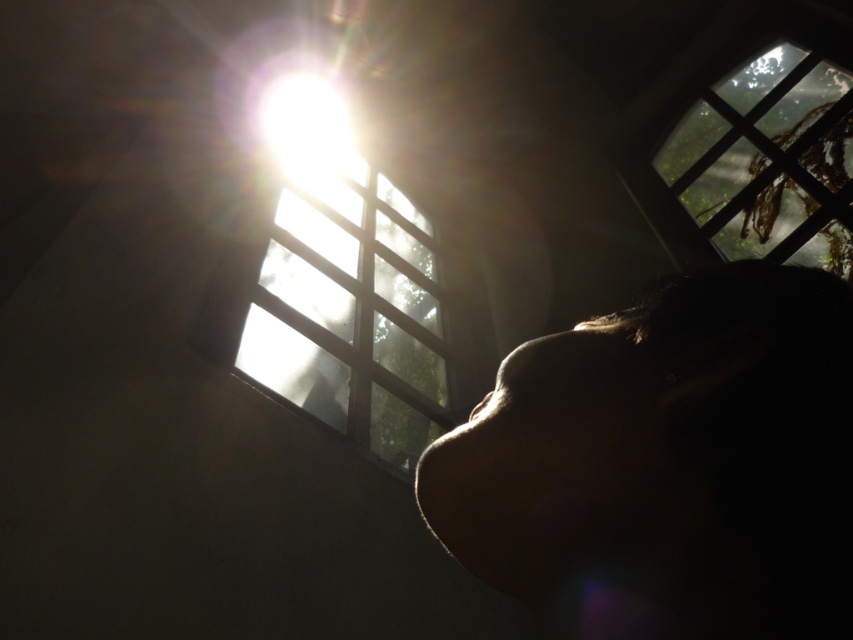
Question: Which of the following is the farthest from the observer?

Choices:
 (A) (326, 77)
 (B) (337, 294)

Answer: (A)

Question: Which of these objects is positioned closest to the bright white light at upper center?

Choices:
 (A) transparent glass window at upper center
 (B) clear glass window at upper right

Answer: (A)

Question: Is matte skin face at upper center above transparent glass window at upper center?

Choices:
 (A) no
 (B) yes

Answer: (A)

Question: In this image, where is matte skin face at upper center located relative to transparent glass window at upper center?

Choices:
 (A) above
 (B) below

Answer: (B)

Question: Is matte skin face at upper center below bright white light at upper center?

Choices:
 (A) yes
 (B) no

Answer: (A)

Question: Among these objects, which one is nearest to the camera?

Choices:
 (A) matte skin face at upper center
 (B) transparent glass window at upper center

Answer: (A)